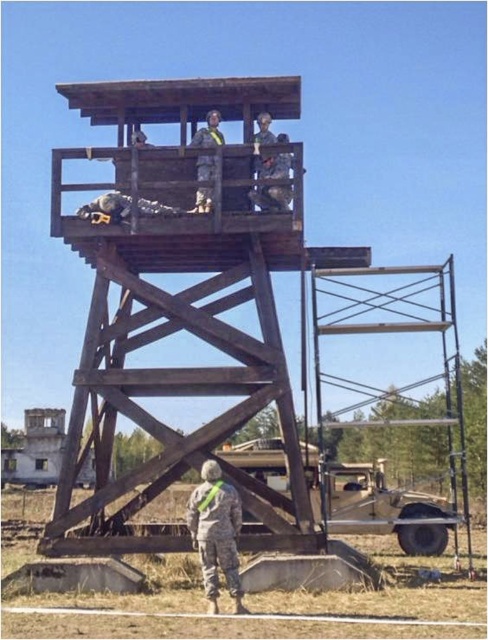
You are a soldier in the watchtower and need to signal to both the camouflage fabric uniform at lower center and the camouflage fabric uniform at center. Which one is positioned to the right of the other?

The camouflage fabric uniform at lower center is to the right of camouflage fabric uniform at center.

You are a drone operator tasked with identifying the position of the camouflage fabric uniform at lower center in the scene. What are the coordinates of this uniform relative to the watchtower?

The camouflage fabric uniform at lower center is located at point coordinates of (216, 532) relative to the watchtower.